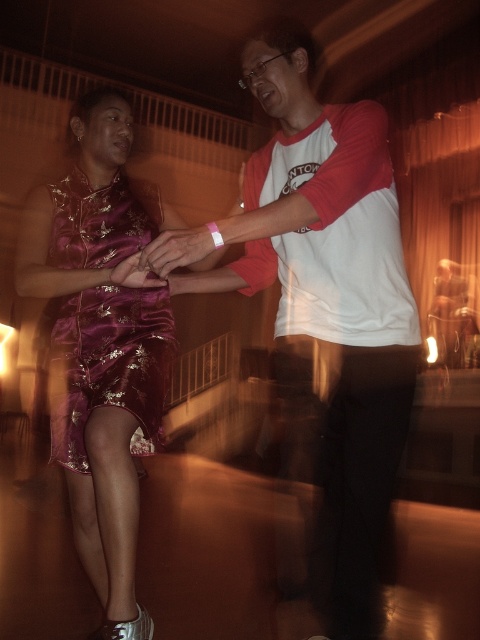
Question: Is matte gold ring at center behind satin purple dress at center?

Choices:
 (A) no
 (B) yes

Answer: (A)

Question: Considering the relative positions of white/red raglan shirt at center and matte gold ring at center in the image provided, where is white/red raglan shirt at center located with respect to matte gold ring at center?

Choices:
 (A) below
 (B) above

Answer: (A)

Question: Based on their relative distances, which object is farther from the satin purple dress at center?

Choices:
 (A) matte gold ring at center
 (B) shiny purple dress at left
 (C) shiny purple dress at center

Answer: (B)

Question: Which point is farther to the camera?

Choices:
 (A) (207, 248)
 (B) (72, 522)
 (C) (59, 323)

Answer: (C)

Question: Considering the real-world distances, which object is farthest from the satin purple dress at center?

Choices:
 (A) shiny purple dress at left
 (B) white/red raglan shirt at center

Answer: (A)

Question: Considering the relative positions of matte gold ring at center and satin purple dress at center in the image provided, where is matte gold ring at center located with respect to satin purple dress at center?

Choices:
 (A) below
 (B) above

Answer: (B)